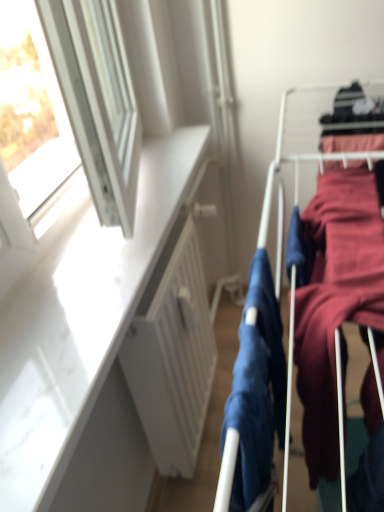
Question: From a real-world perspective, is matte blue fabric at center, which is counted as the 1th clothing, starting from the left, under velvet-like maroon dress at right, the 1th clothing positioned from the right?

Choices:
 (A) no
 (B) yes

Answer: (A)

Question: Is matte blue fabric at center, which is counted as the 1th clothing, starting from the left, at the left side of velvet-like maroon dress at right, the 1th clothing positioned from the right?

Choices:
 (A) no
 (B) yes

Answer: (B)

Question: Is matte blue fabric at center, which is counted as the 1th clothing, starting from the left, positioned far away from velvet-like maroon dress at right, the 1th clothing positioned from the right?

Choices:
 (A) no
 (B) yes

Answer: (A)

Question: Does matte blue fabric at center, which is counted as the 1th clothing, starting from the left, have a smaller size compared to velvet-like maroon dress at right, the second clothing from the left?

Choices:
 (A) yes
 (B) no

Answer: (A)

Question: Does matte blue fabric at center, which is counted as the 1th clothing, starting from the left, have a lesser width compared to velvet-like maroon dress at right, the second clothing from the left?

Choices:
 (A) no
 (B) yes

Answer: (B)

Question: Is matte blue fabric at center, arranged as the 2th clothing when viewed from the right, beside velvet-like maroon dress at right, the 1th clothing positioned from the right?

Choices:
 (A) no
 (B) yes

Answer: (A)

Question: Can you confirm if white matte radiator at center is taller than velvet-like maroon dress at right, the 1th clothing positioned from the right?

Choices:
 (A) no
 (B) yes

Answer: (B)

Question: Is white matte radiator at center outside of velvet-like maroon dress at right, the 1th clothing positioned from the right?

Choices:
 (A) no
 (B) yes

Answer: (B)

Question: From the image's perspective, would you say white matte radiator at center is shown under velvet-like maroon dress at right, the second clothing from the left?

Choices:
 (A) yes
 (B) no

Answer: (A)

Question: Does white matte radiator at center have a lesser height compared to velvet-like maroon dress at right, the 1th clothing positioned from the right?

Choices:
 (A) no
 (B) yes

Answer: (A)

Question: From a real-world perspective, does white matte radiator at center sit lower than velvet-like maroon dress at right, the 1th clothing positioned from the right?

Choices:
 (A) yes
 (B) no

Answer: (A)

Question: Does white matte radiator at center have a lesser width compared to velvet-like maroon dress at right, the 1th clothing positioned from the right?

Choices:
 (A) yes
 (B) no

Answer: (A)

Question: Is white matte radiator at center bigger than matte blue fabric at center, which is counted as the 1th clothing, starting from the left?

Choices:
 (A) no
 (B) yes

Answer: (B)